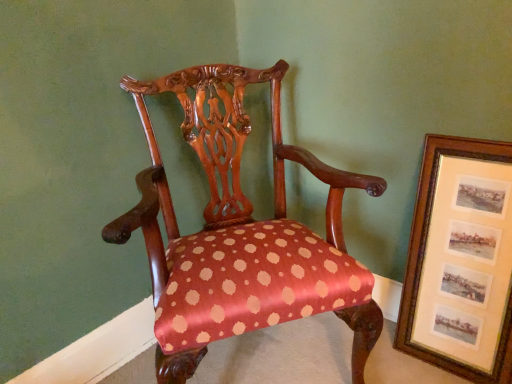
In order to face wooden framed prints at right, should I rotate leftwards or rightwards?

To align with it, rotate right about 24.812°.

Describe the element at coordinates (462, 264) in the screenshot. I see `wooden framed prints at right` at that location.

At what (x,y) coordinates should I click in order to perform the action: click on wooden framed prints at right. Please return your answer as a coordinate pair (x, y). The image size is (512, 384). Looking at the image, I should click on (462, 264).

Find the location of a particular element. polished wood chair at center is located at coordinates (240, 232).

The width and height of the screenshot is (512, 384). What do you see at coordinates (240, 232) in the screenshot?
I see `polished wood chair at center` at bounding box center [240, 232].

Image resolution: width=512 pixels, height=384 pixels. What are the coordinates of `wooden framed prints at right` in the screenshot? It's located at (462, 264).

Is polished wood chair at center at the left side of wooden framed prints at right?

Yes, polished wood chair at center is to the left of wooden framed prints at right.

Considering the relative positions of polished wood chair at center and wooden framed prints at right in the image provided, is polished wood chair at center behind wooden framed prints at right?

That is False.

Which is less distant, [196,126] or [459,235]?

Point [196,126] is farther from the camera than point [459,235].

From the image's perspective, which is above, polished wood chair at center or wooden framed prints at right?

polished wood chair at center appears higher in the image.

From a real-world perspective, is polished wood chair at center on top of wooden framed prints at right?

Correct, in the physical world, polished wood chair at center is higher than wooden framed prints at right.

Can you confirm if polished wood chair at center is thinner than wooden framed prints at right?

A: Incorrect, the width of polished wood chair at center is not less than that of wooden framed prints at right.

Does polished wood chair at center have a greater height compared to wooden framed prints at right?

Yes, polished wood chair at center is taller than wooden framed prints at right.

Which of these two, polished wood chair at center or wooden framed prints at right, is bigger?

polished wood chair at center.

Is polished wood chair at center completely or partially outside of wooden framed prints at right?

polished wood chair at center lies outside wooden framed prints at right's area.

Is there a large distance between polished wood chair at center and wooden framed prints at right?

polished wood chair at center is actually quite close to wooden framed prints at right.

Is polished wood chair at center facing towards wooden framed prints at right?

No, polished wood chair at center is not turned towards wooden framed prints at right.

This screenshot has height=384, width=512. In order to click on chair above the wooden framed prints at right (from a real-world perspective) in this screenshot , I will do `click(240, 232)`.

Considering the positions of objects wooden framed prints at right and polished wood chair at center in the image provided, who is more to the right, wooden framed prints at right or polished wood chair at center?

Positioned to the right is wooden framed prints at right.

Consider the image. Between wooden framed prints at right and polished wood chair at center, which one is positioned in front?

polished wood chair at center is closer to the camera.

Considering the points (503, 326) and (226, 236), which point is behind, point (503, 326) or point (226, 236)?

The point (226, 236) is farther from the camera.

From the image's perspective, which object appears higher, wooden framed prints at right or polished wood chair at center?

polished wood chair at center appears higher in the image.

From the picture: From a real-world perspective, who is located higher, wooden framed prints at right or polished wood chair at center?

polished wood chair at center, from a real-world perspective.

Consider the image. Considering the sizes of wooden framed prints at right and polished wood chair at center in the image, is wooden framed prints at right wider or thinner than polished wood chair at center?

In the image, wooden framed prints at right appears to be more narrow than polished wood chair at center.

Is wooden framed prints at right taller than polished wood chair at center?

Incorrect, the height of wooden framed prints at right is not larger of that of polished wood chair at center.

From the picture: Is wooden framed prints at right smaller than polished wood chair at center?

Correct, wooden framed prints at right occupies less space than polished wood chair at center.

Is wooden framed prints at right completely or partially outside of polished wood chair at center?

That's correct, wooden framed prints at right is outside of polished wood chair at center.

Is wooden framed prints at right positioned far away from polished wood chair at center?

Actually, wooden framed prints at right and polished wood chair at center are a little close together.

In the scene shown: Is wooden framed prints at right turned away from polished wood chair at center?

No, wooden framed prints at right is not facing away from polished wood chair at center.

Can you tell me how much wooden framed prints at right and polished wood chair at center differ in facing direction?

57.6 degrees.

This screenshot has width=512, height=384. Identify the location of chair lying on the left of wooden framed prints at right. (240, 232).

Where is `chair that appears on the left of wooden framed prints at right`? This screenshot has height=384, width=512. chair that appears on the left of wooden framed prints at right is located at coordinates click(240, 232).

In the image, there is a wooden framed prints at right. Where is `chair above it (from the image's perspective)`? The width and height of the screenshot is (512, 384). chair above it (from the image's perspective) is located at coordinates (240, 232).